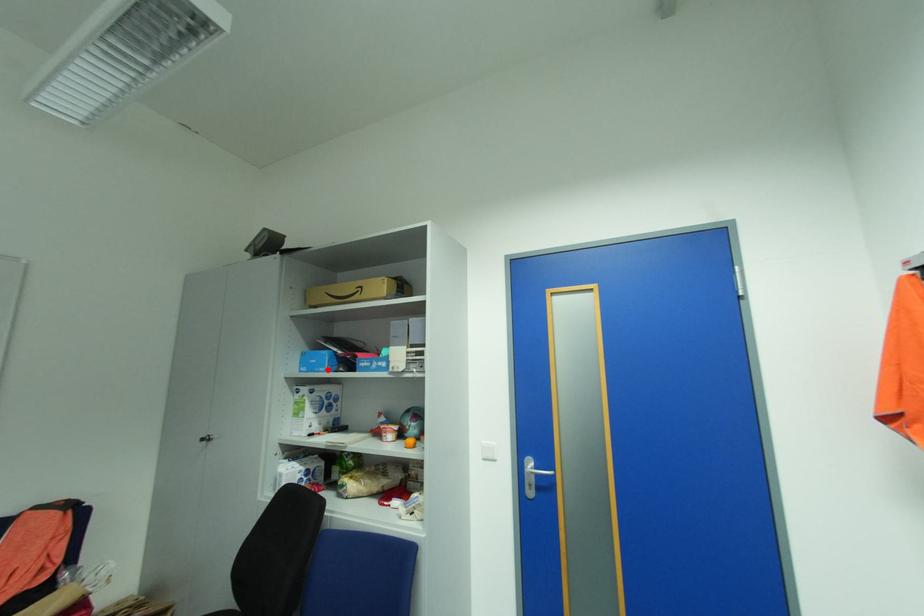
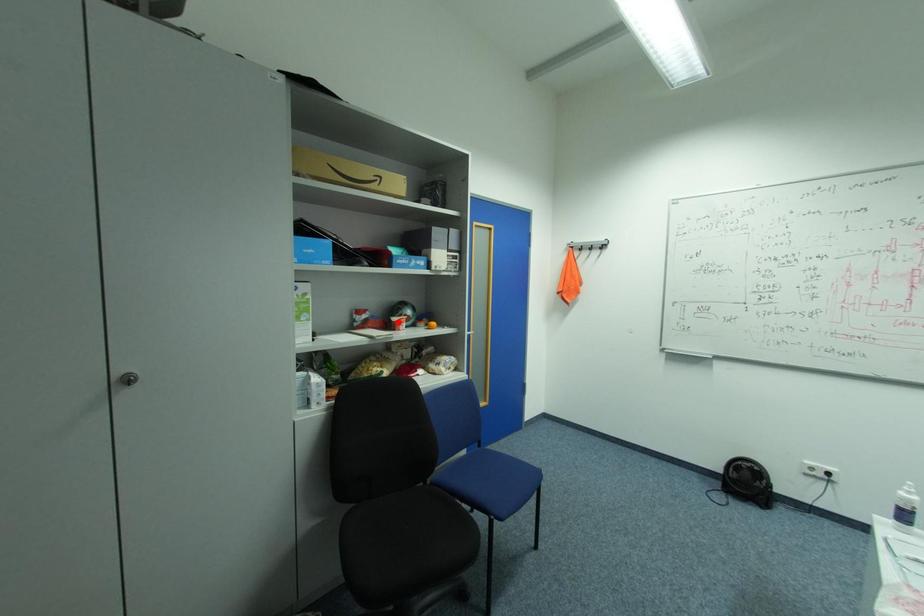
I am providing you with two images of the same scene from different viewpoints. A red point is marked on the first image and another point is marked on the second image. Is the marked point in image1 the same physical position as the marked point in image2?

No